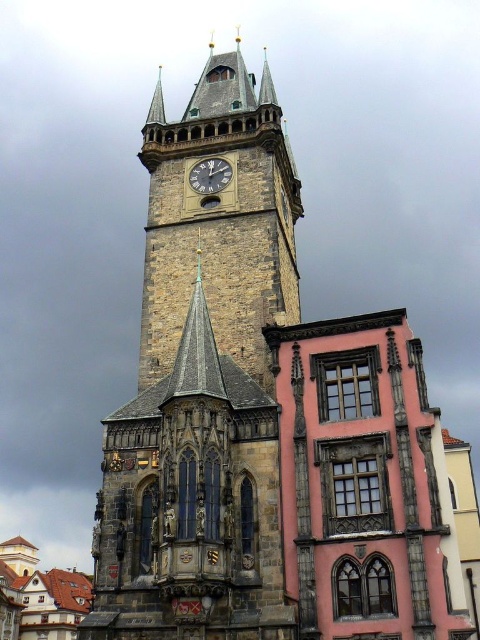
Which is more to the left, stone clock tower at center or dark gray stone clock at center?

From the viewer's perspective, stone clock tower at center appears more on the left side.

What do you see at coordinates (219, 218) in the screenshot? I see `stone clock tower at center` at bounding box center [219, 218].

Where is `stone clock tower at center`? stone clock tower at center is located at coordinates (219, 218).